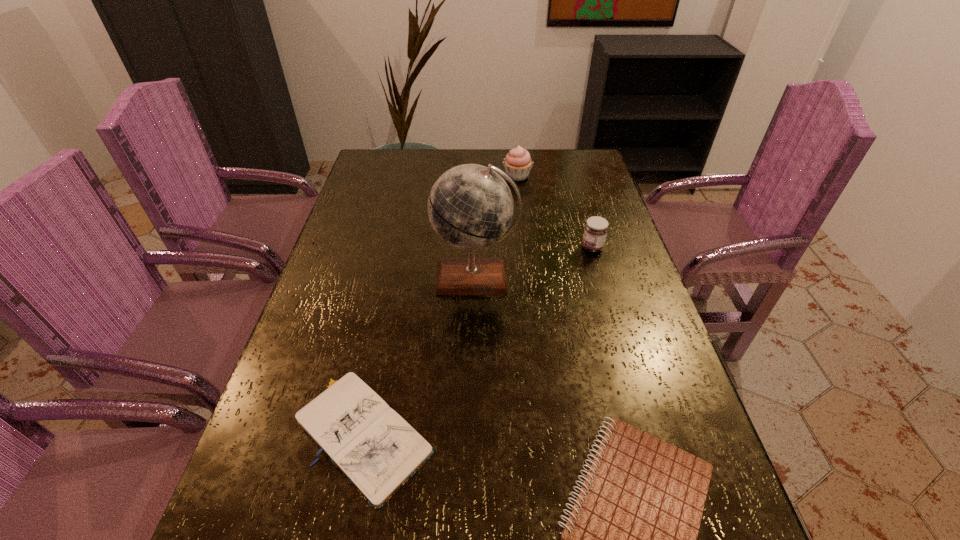
This screenshot has height=540, width=960. I want to click on vacant region located 0.150m on the right of the left notebook, so click(x=515, y=433).

The image size is (960, 540). I want to click on object that is at the far edge, so (517, 163).

The width and height of the screenshot is (960, 540). I want to click on object that is positioned at the left edge, so click(377, 451).

What are the coordinates of `object that is at the right edge` in the screenshot? It's located at (596, 228).

In the image, there is a desktop. Where is `free space at the far edge`? The height and width of the screenshot is (540, 960). free space at the far edge is located at coordinates (535, 157).

In the image, there is a desktop. Where is `vacant space at the left edge`? The height and width of the screenshot is (540, 960). vacant space at the left edge is located at coordinates (356, 301).

The width and height of the screenshot is (960, 540). In the image, there is a desktop. Find the location of `vacant space at the right edge`. vacant space at the right edge is located at coordinates (639, 280).

I want to click on free region at the far left corner, so click(410, 158).

Find the location of `unoccupied area between the second tallest object and the jam`. unoccupied area between the second tallest object and the jam is located at coordinates (555, 212).

Where is `unoccupied area between the globe and the third tallest object`? The image size is (960, 540). unoccupied area between the globe and the third tallest object is located at coordinates (534, 263).